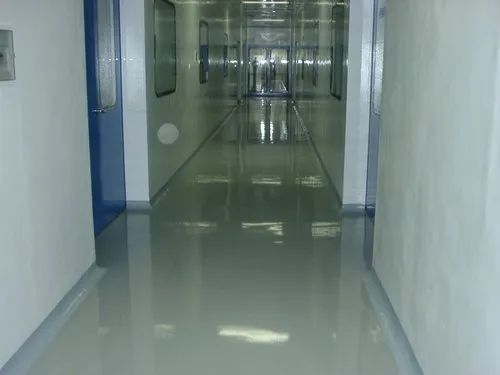
I want to click on hallway doors, so click(263, 70), click(279, 73).